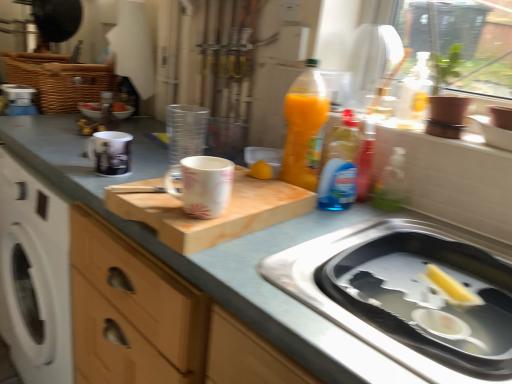
Where is `free point above wooden cutting board at center (from a real-world perspective)`? free point above wooden cutting board at center (from a real-world perspective) is located at coordinates (231, 181).